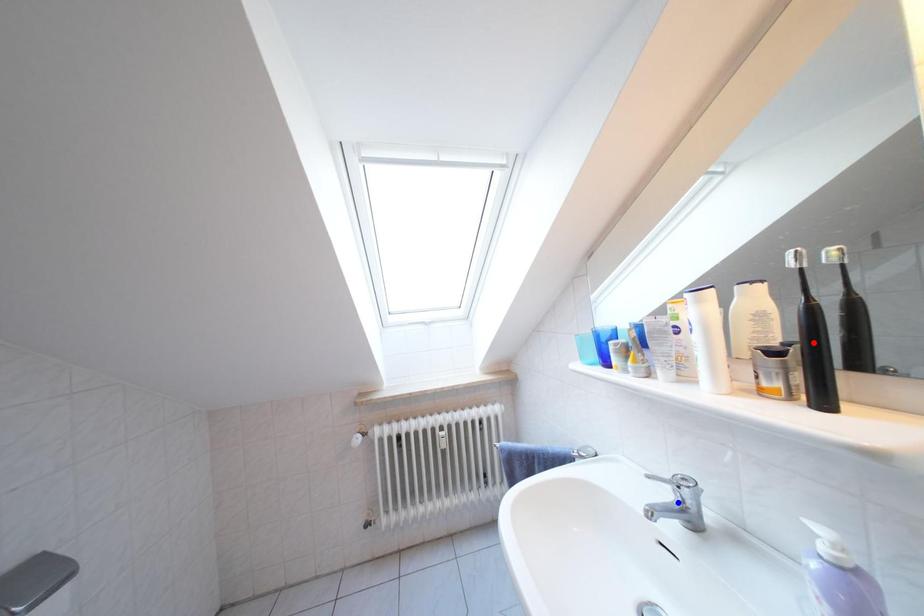
Question: Two points are marked on the image. Which point is closer to the camera?

Choices:
 (A) Blue point is closer.
 (B) Red point is closer.

Answer: (B)